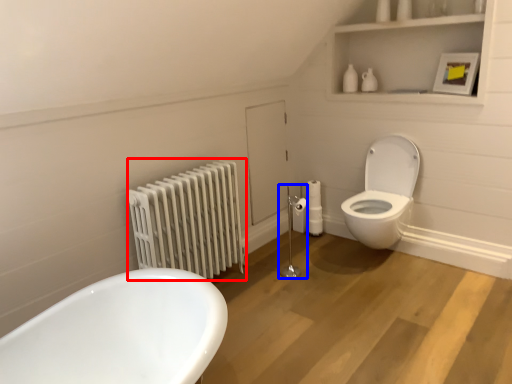
Question: Which object appears farthest to the camera in this image, radiator (highlighted by a red box) or shower (highlighted by a blue box)?

Choices:
 (A) radiator
 (B) shower

Answer: (B)